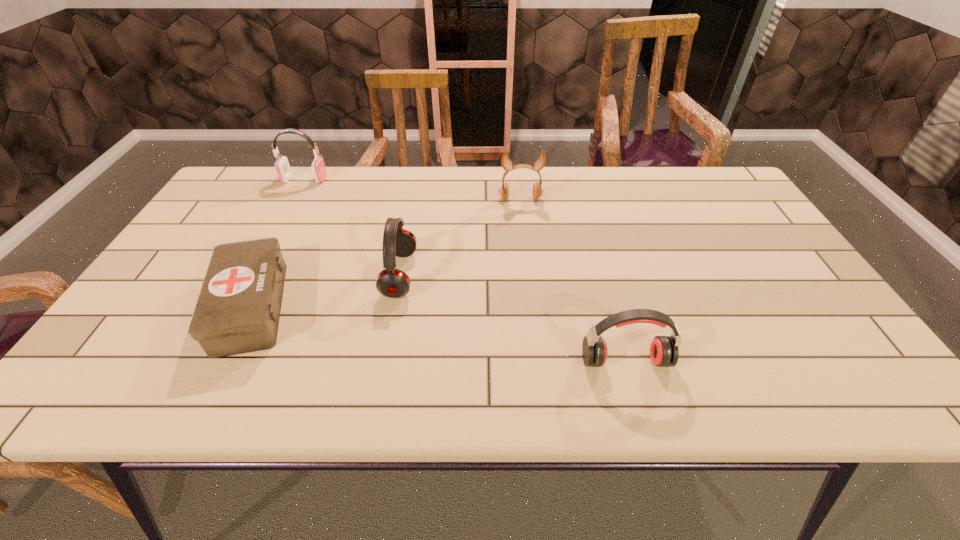
Locate an element on the screen. the farthest object is located at coordinates [282, 166].

Find the location of a particular element. the leftmost earphone is located at coordinates (282, 166).

Find the location of a particular element. This screenshot has height=540, width=960. the second farthest earphone is located at coordinates (506, 162).

I want to click on the second earphone from right to left, so click(506, 162).

Find the location of a particular element. The height and width of the screenshot is (540, 960). the third farthest earphone is located at coordinates (392, 283).

Where is `the third object from left to right`? the third object from left to right is located at coordinates (392, 283).

The width and height of the screenshot is (960, 540). In order to click on the nearest earphone in this screenshot , I will do `click(664, 352)`.

You are a GUI agent. You are given a task and a screenshot of the screen. Output one action in this format:
    pyautogui.click(x=<x>, y=<y>)
    Task: Click on the rightmost earphone
    Image resolution: width=960 pixels, height=540 pixels.
    Given the screenshot: What is the action you would take?
    pyautogui.click(x=664, y=352)

Where is `the first-aid kit`? The image size is (960, 540). the first-aid kit is located at coordinates (238, 309).

I want to click on vacant space located 0.050m on the outer surface of the farthest earphone, so click(341, 179).